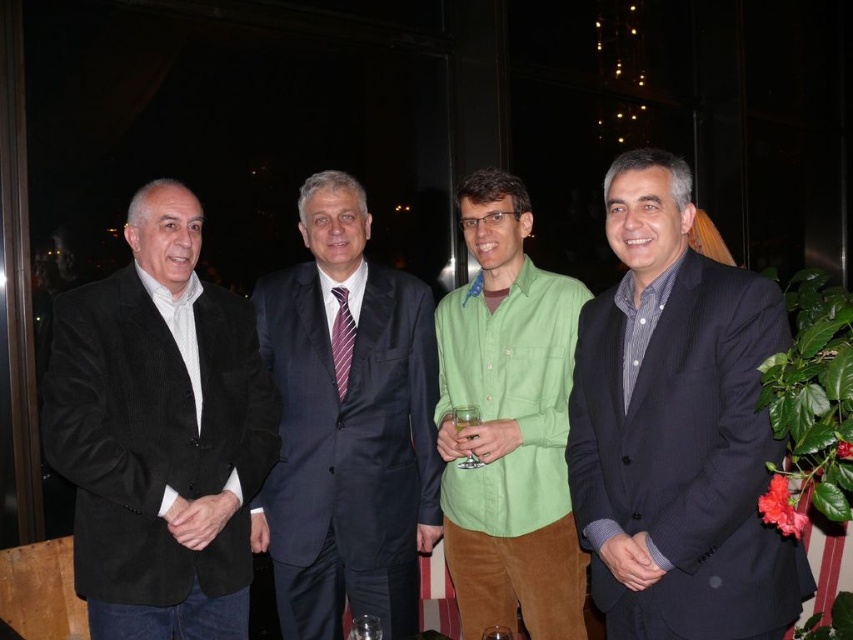
Between point (364, 636) and point (495, 634), which one is positioned behind?

The point (495, 634) is more distant.

Between clear glass wine glass at center and transparent glass at center, which one is positioned higher?

clear glass wine glass at center is higher up.

Does point (375, 627) come closer to viewer compared to point (505, 634)?

No, (375, 627) is further to viewer.

Find the location of a particular element. The image size is (853, 640). clear glass wine glass at center is located at coordinates (364, 627).

Which of these two, black corduroy blazer at left or dark blue suit at center, stands shorter?

black corduroy blazer at left is shorter.

Where is `black corduroy blazer at left`? This screenshot has height=640, width=853. black corduroy blazer at left is located at coordinates (160, 433).

Does dark blue pinstripe suit at center lie in front of clear glass at center?

Yes, dark blue pinstripe suit at center is in front of clear glass at center.

Is dark blue pinstripe suit at center below clear glass at center?

Incorrect, dark blue pinstripe suit at center is not positioned below clear glass at center.

This screenshot has height=640, width=853. What do you see at coordinates (677, 428) in the screenshot?
I see `dark blue pinstripe suit at center` at bounding box center [677, 428].

Where is `dark blue pinstripe suit at center`? dark blue pinstripe suit at center is located at coordinates (677, 428).